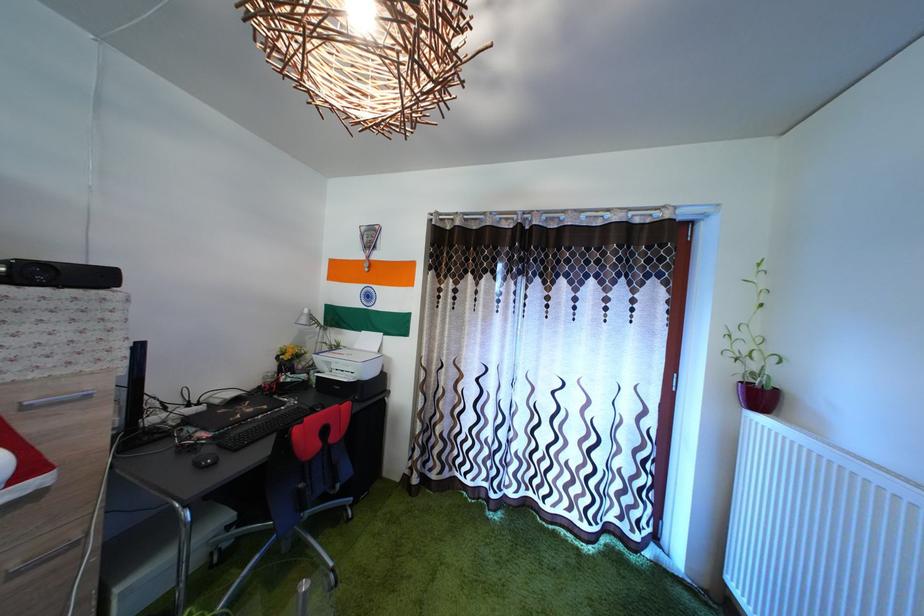
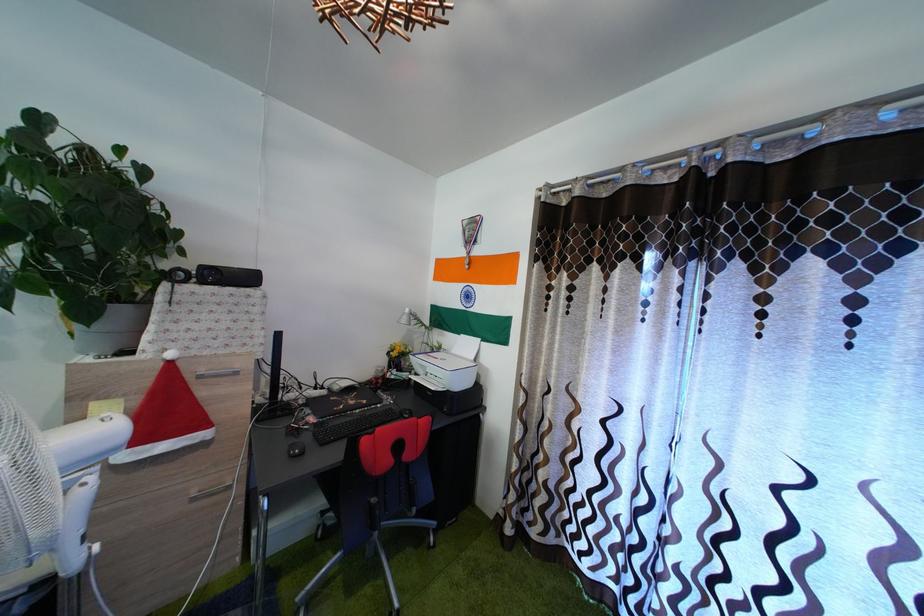
The point at [106,285] is marked in the first image. Where is the corresponding point in the second image?

(257, 286)